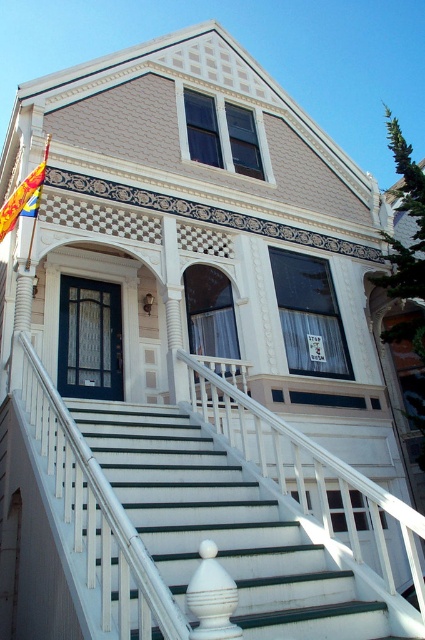
The height and width of the screenshot is (640, 425). Describe the element at coordinates (221, 525) in the screenshot. I see `white painted wood stairs at center` at that location.

Who is shorter, white painted wood stairs at center or yellow and blue striped flag at upper left?

Standing shorter between the two is white painted wood stairs at center.

Does point (118, 406) come closer to viewer compared to point (37, 180)?

Yes, it is.

Image resolution: width=425 pixels, height=640 pixels. Find the location of `white painted wood stairs at center`. white painted wood stairs at center is located at coordinates (221, 525).

Who is positioned more to the right, white glossy post at center or yellow and blue striped flag at upper left?

white glossy post at center

Is point (234, 589) more distant than point (5, 202)?

No.

Find the location of a particular element. white glossy post at center is located at coordinates (212, 596).

Based on the photo, does white painted wood stairs at center have a larger size compared to white glossy post at center?

Yes, white painted wood stairs at center is bigger than white glossy post at center.

Can you confirm if white painted wood stairs at center is positioned above white glossy post at center?

Actually, white painted wood stairs at center is below white glossy post at center.

Does point (206, 476) come behind point (187, 584)?

Yes, point (206, 476) is farther from viewer.

Locate an element on the screen. The height and width of the screenshot is (640, 425). white painted wood stairs at center is located at coordinates (221, 525).